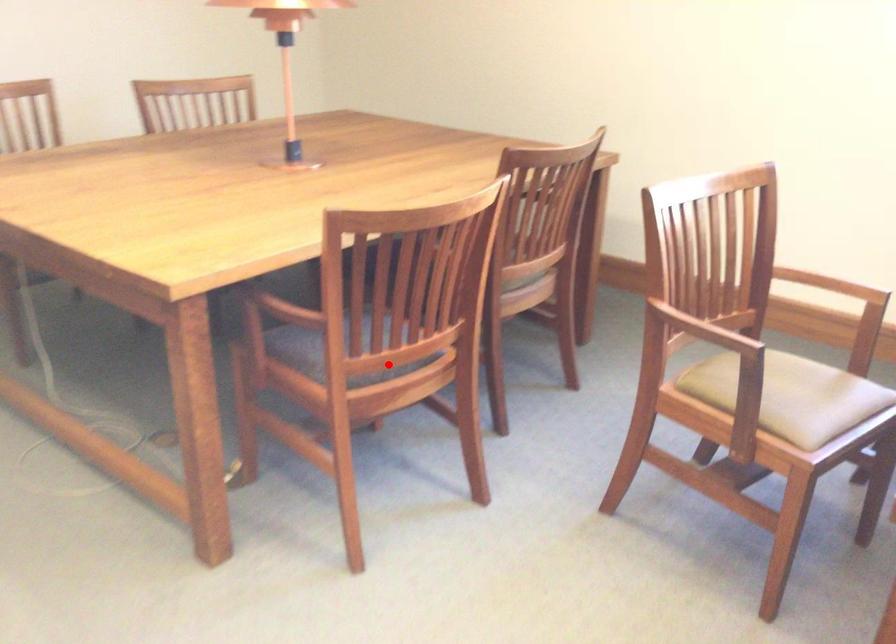
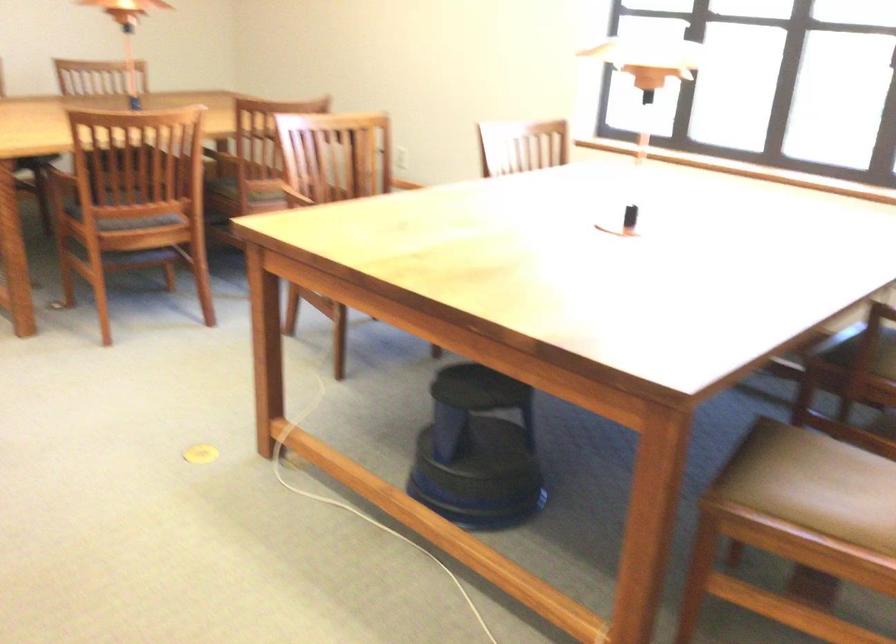
Where in the second image is the point corresponding to the highlighted location from the first image?

(128, 209)